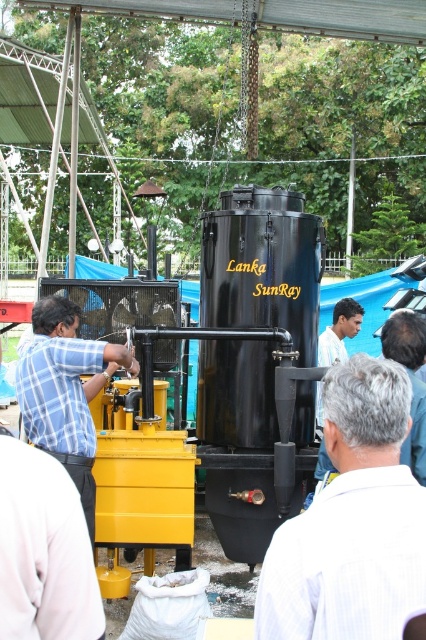
You are a photographer trying to capture a clear shot of both the gray hair at center and the light blue shirt at center in the scene. Since you want both subjects to be in focus, which one should you adjust your camera focus on first?

You should focus on the gray hair at center first because it is closer to the viewer than the light blue shirt at center. By focusing on the closer subject, the farther one may still be within the depth of field, increasing the chances of both being in focus.

Please describe the location of the gray hair at center in the image using coordinates.

The gray hair at center is located at coordinates point (353,522).

You are a technician who needs to reach the gray hair at upper right from the light blue shirt at center. Can you walk directly to it without any obstacles?

The gray hair at upper right is 3.11 meters away from the light blue shirt at center. Since there are no mentioned obstacles in the scene description, you can walk directly to it.